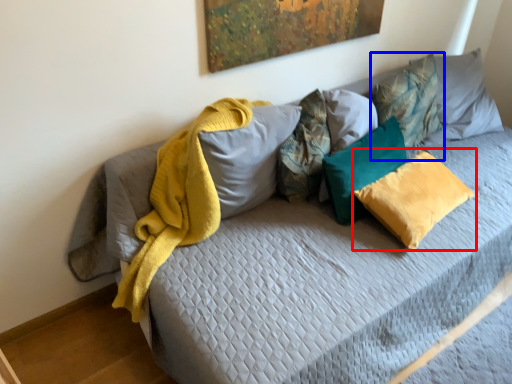
Question: Which of the following is the closest to the observer, pillow (highlighted by a red box) or pillow (highlighted by a blue box)?

Choices:
 (A) pillow
 (B) pillow

Answer: (A)